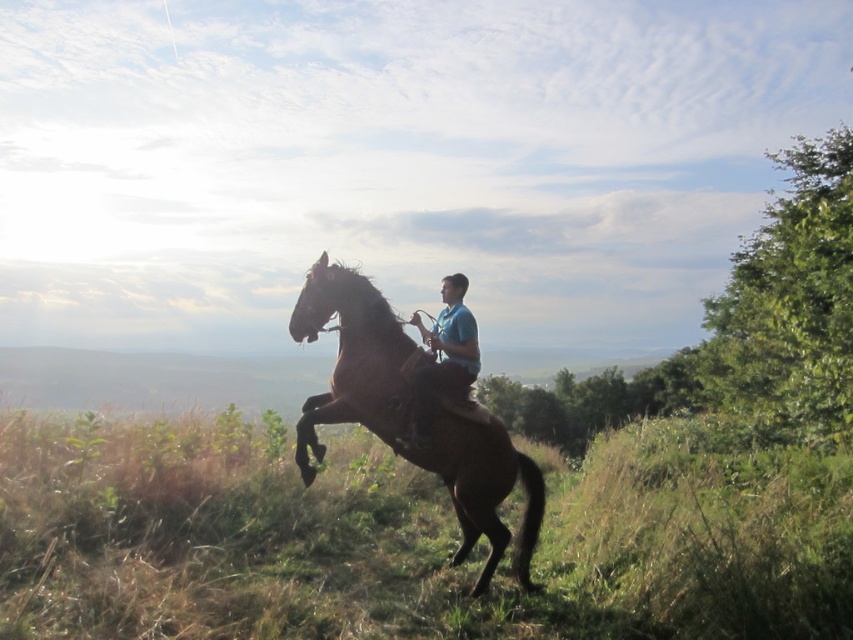
Is brown glossy horse at center to the left of blue smooth shirt at center from the viewer's perspective?

Correct, you'll find brown glossy horse at center to the left of blue smooth shirt at center.

What do you see at coordinates (408, 413) in the screenshot? This screenshot has height=640, width=853. I see `brown glossy horse at center` at bounding box center [408, 413].

Identify the location of brown glossy horse at center. (408, 413).

Can you confirm if brown grassy at center is positioned above blue smooth shirt at center?

No.

How far apart are brown grassy at center and blue smooth shirt at center?

They are 10.59 feet apart.

Is point (328, 458) more distant than point (412, 385)?

Yes, point (328, 458) is farther from viewer.

What are the coordinates of `brown grassy at center` in the screenshot? It's located at (410, 540).

Is brown grassy at center behind brown glossy horse at center?

No, brown grassy at center is in front of brown glossy horse at center.

Which of these two, brown grassy at center or brown glossy horse at center, stands taller?

With more height is brown glossy horse at center.

Does point (572, 509) come in front of point (358, 348)?

No, it is behind (358, 348).

I want to click on brown grassy at center, so click(410, 540).